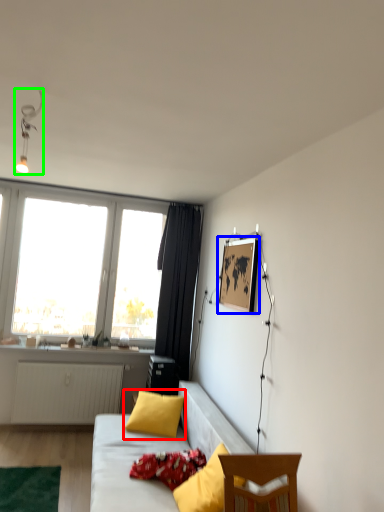
Question: Estimate the real-world distances between objects in this image. Which object is farther from pillow (highlighted by a red box), picture frame (highlighted by a blue box) or light fixture (highlighted by a green box)?

Choices:
 (A) picture frame
 (B) light fixture

Answer: (B)